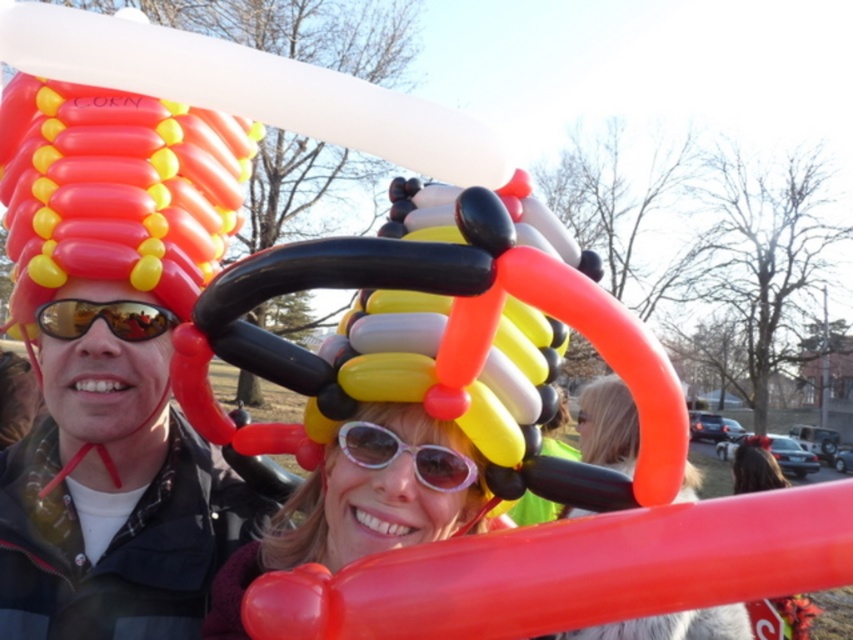
You are a photographer trying to capture both the matte black sunglasses at center and the matte orange balloon at center in a single frame. Considering their sizes, which object should you focus on first to ensure both fit in the shot?

The matte black sunglasses at center is smaller than the matte orange balloon at center, so you should focus on the matte orange balloon at center first to ensure both fit in the shot.

From the picture: You are standing in the park and want to take a photo of the point at coordinates point [383,472]. The camera you are using has a focal length of 50mm and a sensor size of 24mm x 36mm. Can you estimate if the point is within the camera field of view?

The point [383,472] is 3.91 feet away from the camera. To determine if it is within the field of view, we can calculate the camera field of view using the formula field of view angle in degrees equals 2 times arctangent of sensor dimension divided by 2 times focal length. For a 50mm focal length and 24mm sensor width, the horizontal field of view is approximately 39.6 degrees. The distance to the point is 3.91 feet, so the maximum horizontal distance the camera can capture at that distance is distance in